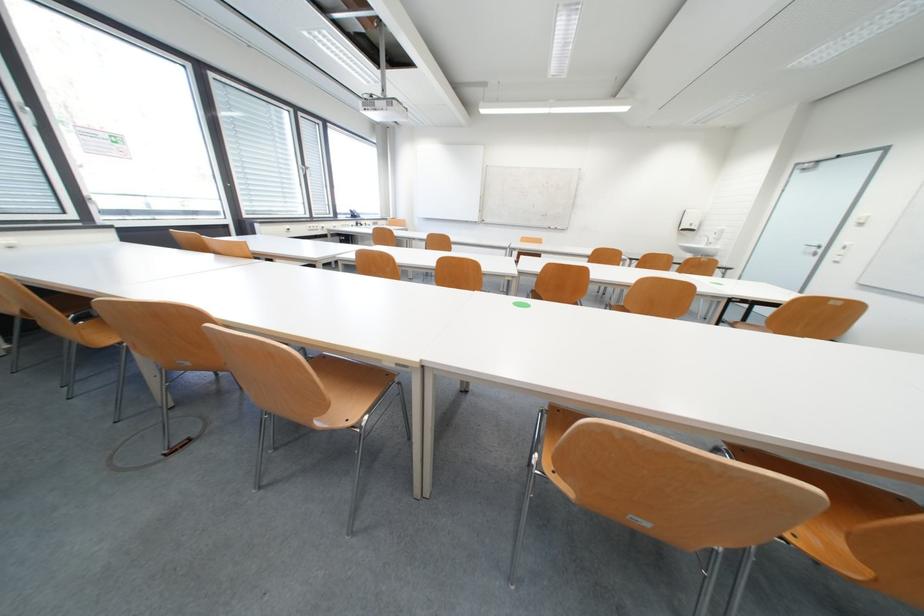
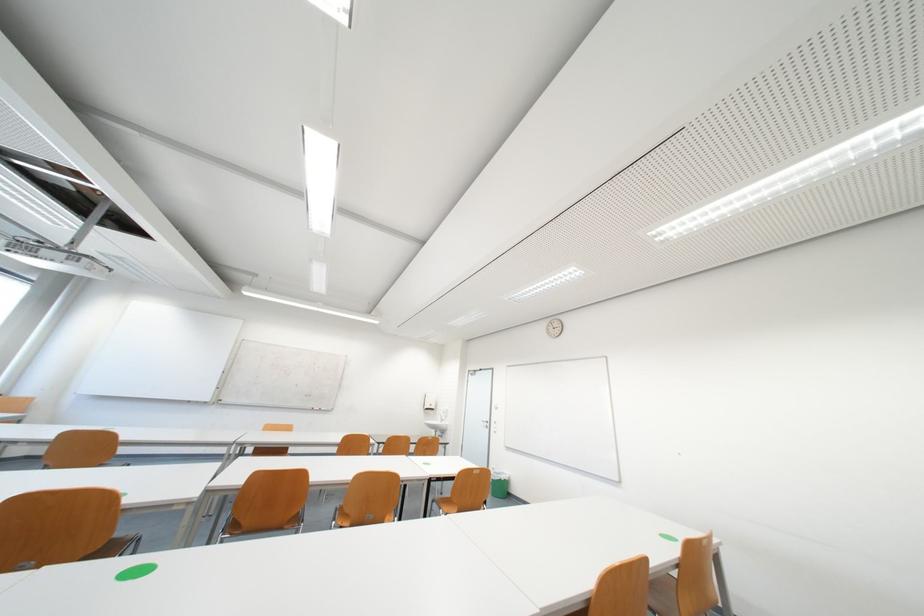
Locate, in the second image, the point that corresponds to point 712,232 in the first image.

(445, 411)